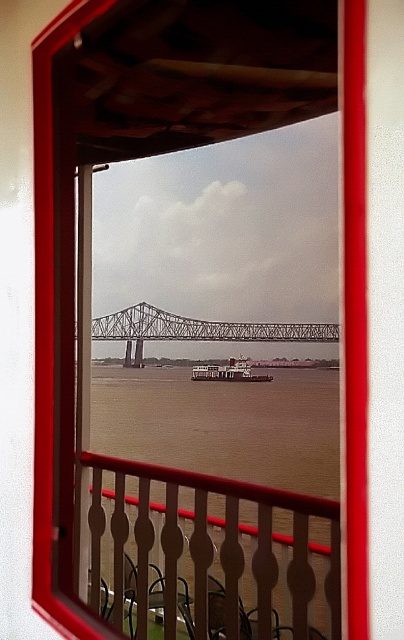
You are standing on the balcony and looking through the window. You see the metallic gray bridge at center and the white matte barge at center. Which object is closer to you?

The metallic gray bridge at center is closer to you because the white matte barge at center is behind it.

In the scene shown: You are a painter standing on the balcony with a 2.5 meter long ladder. You want to paint both the brown wood railing at center and the metallic gray bridge at center. Can you reach both objects with your ladder without moving it?

The brown wood railing at center and metallic gray bridge at center are 2.42 meters apart. Since the ladder is 2.5 meters long, you can reach both objects as the distance between them is less than the ladder length.

You are standing in a room with a window and want to take a photo of the brown wood railing at center through the window. If your camera is 7.55 feet away from the railing, is it possible to capture the entire railing in one shot without moving the camera?

The brown wood railing at center and camera are 7.55 feet apart, so yes, it is possible to capture the entire railing in one shot without moving the camera if the camera lens has an appropriate angle of view.